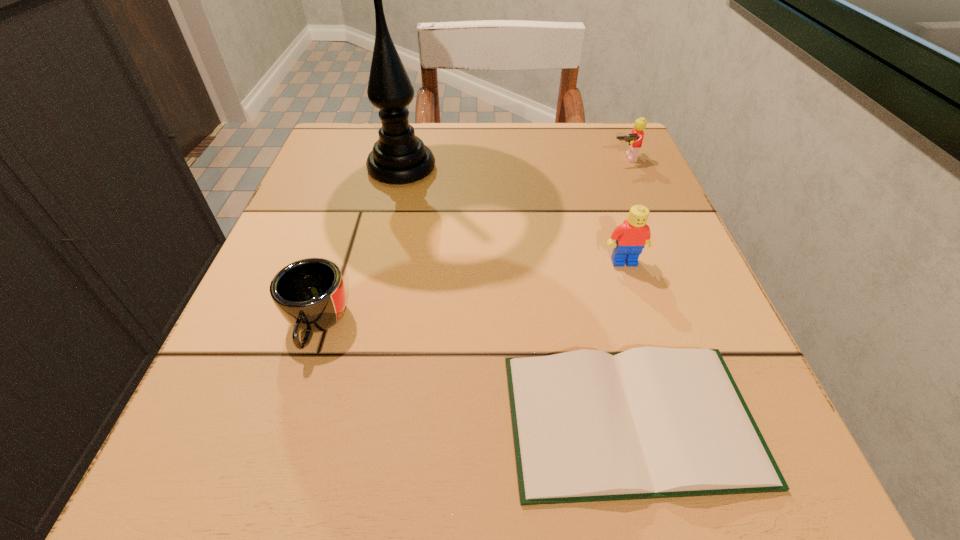
Where is `empty location between the shortest object and the tallest object`? The image size is (960, 540). empty location between the shortest object and the tallest object is located at coordinates (516, 294).

The image size is (960, 540). What are the coordinates of `free space between the farther Lego and the left Lego` in the screenshot? It's located at (624, 210).

At what (x,y) coordinates should I click in order to perform the action: click on unoccupied position between the shortest object and the farther Lego. Please return your answer as a coordinate pair (x, y). Looking at the image, I should click on (627, 289).

Identify the location of empty space that is in between the farther Lego and the taller Lego. The height and width of the screenshot is (540, 960). (624, 210).

Image resolution: width=960 pixels, height=540 pixels. In order to click on vacant area that lies between the farther Lego and the lamp in this screenshot , I will do `click(513, 163)`.

Locate an element on the screen. This screenshot has width=960, height=540. free space between the fourth tallest object and the shorter Lego is located at coordinates (470, 241).

Locate an element on the screen. This screenshot has width=960, height=540. free space between the fourth tallest object and the left Lego is located at coordinates (470, 293).

Identify which object is located as the nearest to the hardback book. Please provide its 2D coordinates. Your answer should be formatted as a tuple, i.e. [(x, y)], where the tuple contains the x and y coordinates of a point satisfying the conditions above.

[(631, 237)]

Identify which object is located as the second nearest to the taller Lego. Please provide its 2D coordinates. Your answer should be formatted as a tuple, i.e. [(x, y)], where the tuple contains the x and y coordinates of a point satisfying the conditions above.

[(398, 157)]